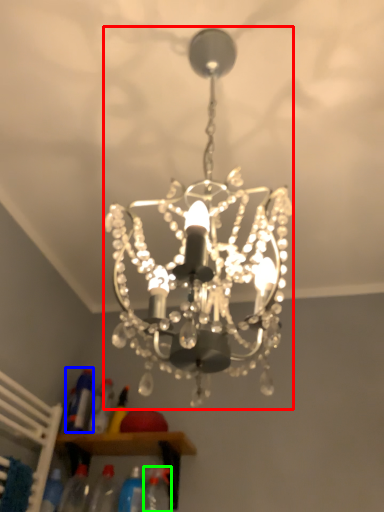
Question: Based on their relative distances, which object is nearer to lamp (highlighted by a red box)? Choose from bottle (highlighted by a blue box) and bottle (highlighted by a green box).

Choices:
 (A) bottle
 (B) bottle

Answer: (B)